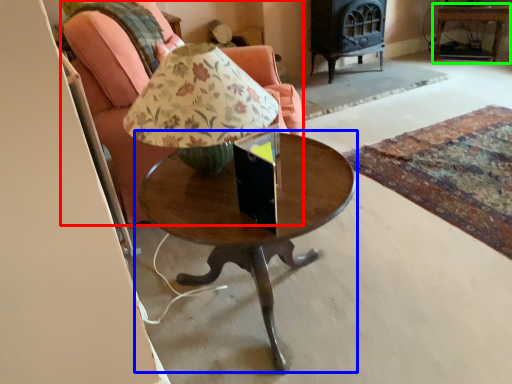
Question: Which object is the farthest from chair (highlighted by a red box)? Choose among these: coffee table (highlighted by a blue box) or side table (highlighted by a green box).

Choices:
 (A) coffee table
 (B) side table

Answer: (B)